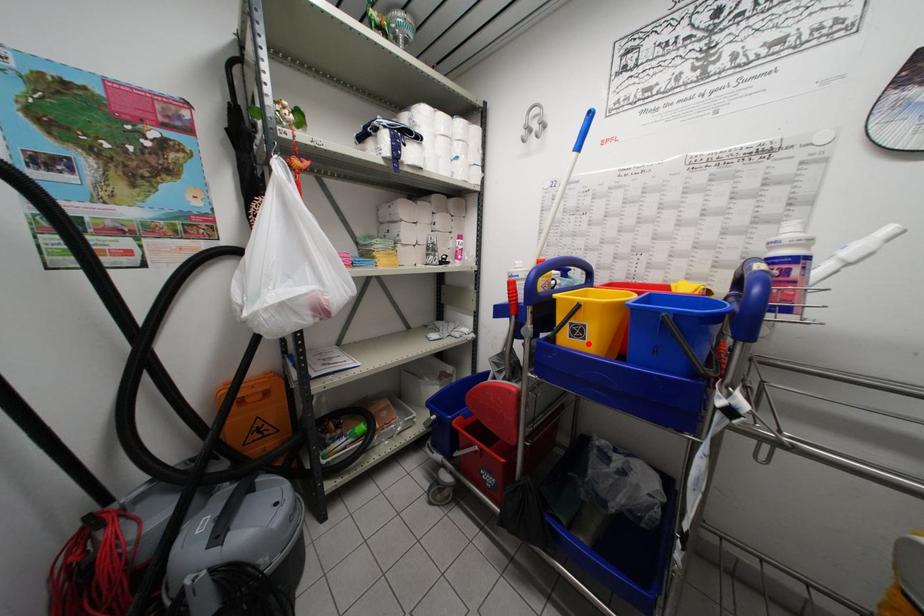
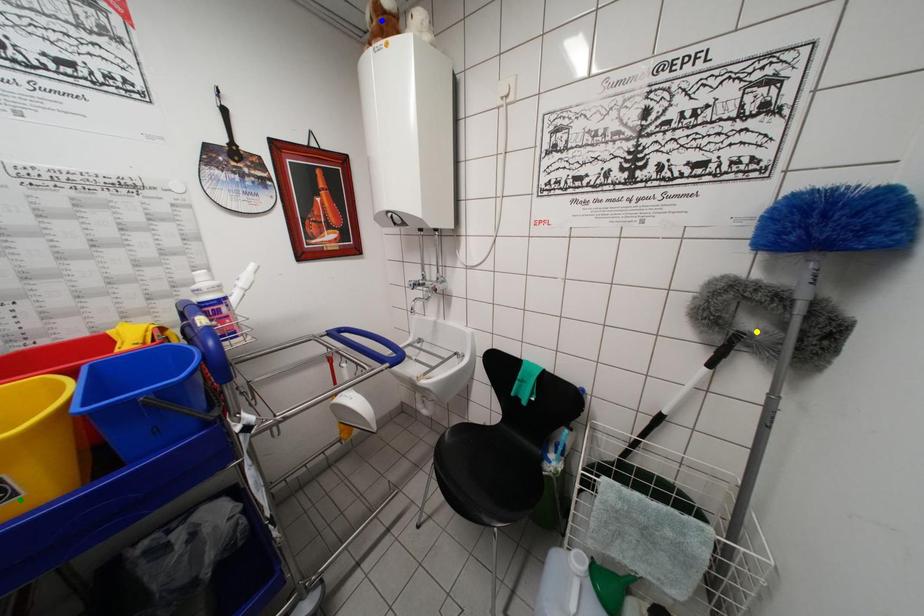
Question: I am providing you with two images of the same scene from different viewpoints. A red point is marked on the first image. You are given multiple points on the second image. In image 2, which mark is for the same physical point as the one in image 1?

Choices:
 (A) blue point
 (B) green point
 (C) yellow point

Answer: (B)